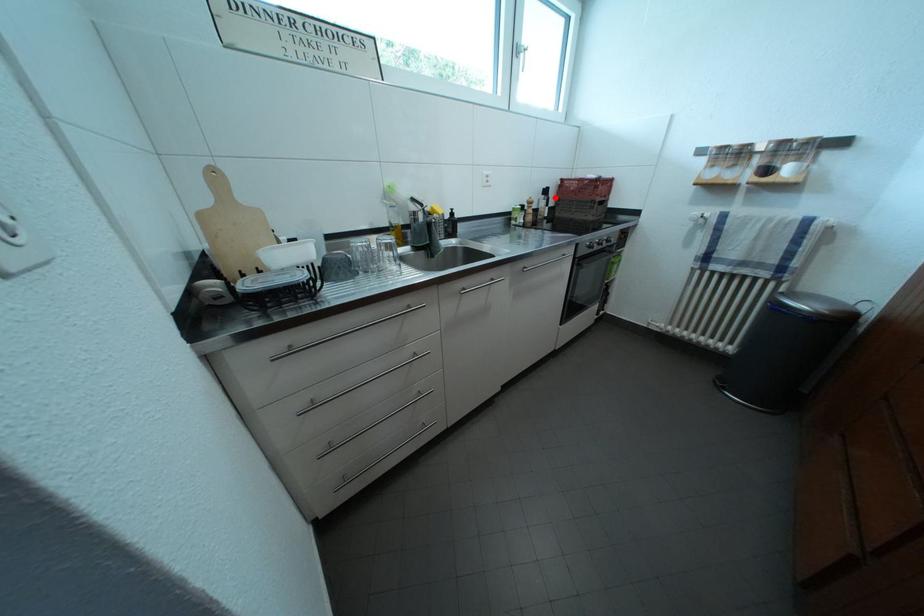
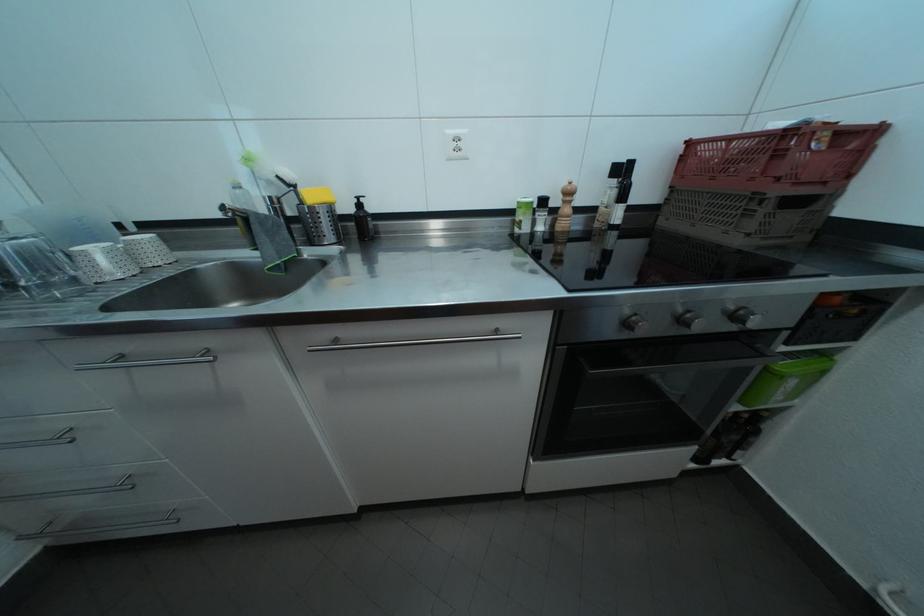
Question: I am providing you with two images of the same scene from different viewpoints. In image1, a red point is highlighted. Considering the same 3D point in image2, which of the following is correct?

Choices:
 (A) It is closer
 (B) It is farther

Answer: (B)